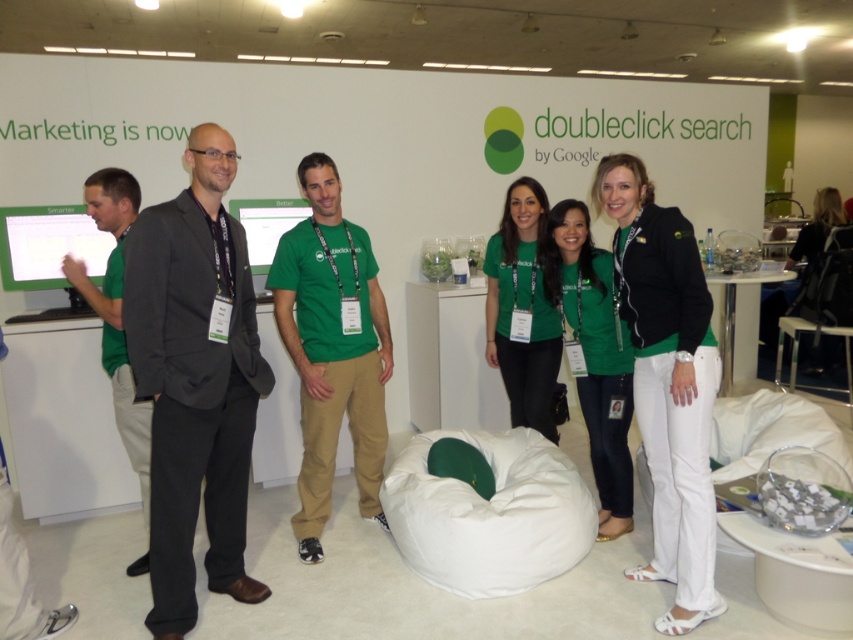
Does point (206, 212) come in front of point (679, 240)?

That is False.

Between point (189, 224) and point (669, 248), which one is positioned behind?

The point (669, 248) is behind.

The image size is (853, 640). In order to click on dark gray suit at center in this screenshot , I will do `click(195, 380)`.

Is the position of black matte jacket at right less distant than that of green cotton t-shirt at center?

Yes, black matte jacket at right is closer to the viewer.

Is black matte jacket at right above green cotton t-shirt at center?

No.

Is point (634, 188) less distant than point (350, 401)?

Yes, it is.

Locate an element on the screen. The height and width of the screenshot is (640, 853). black matte jacket at right is located at coordinates (666, 381).

Is black matte jacket at right below green fabric shirt at left?

Yes.

Does point (666, 413) come behind point (126, 196)?

That is False.

I want to click on black matte jacket at right, so click(x=666, y=381).